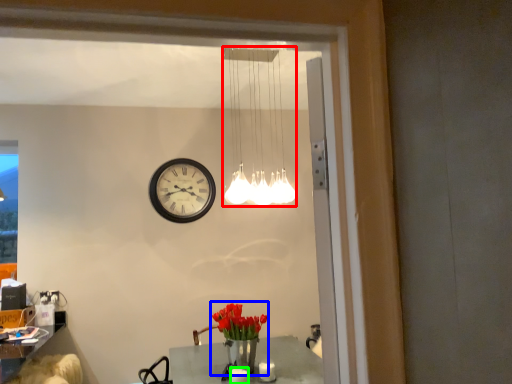
Question: Considering the real-world distances, which object is closest to lamp (highlighted by a red box)? floral arrangement (highlighted by a blue box) or candle (highlighted by a green box).

Choices:
 (A) floral arrangement
 (B) candle

Answer: (A)